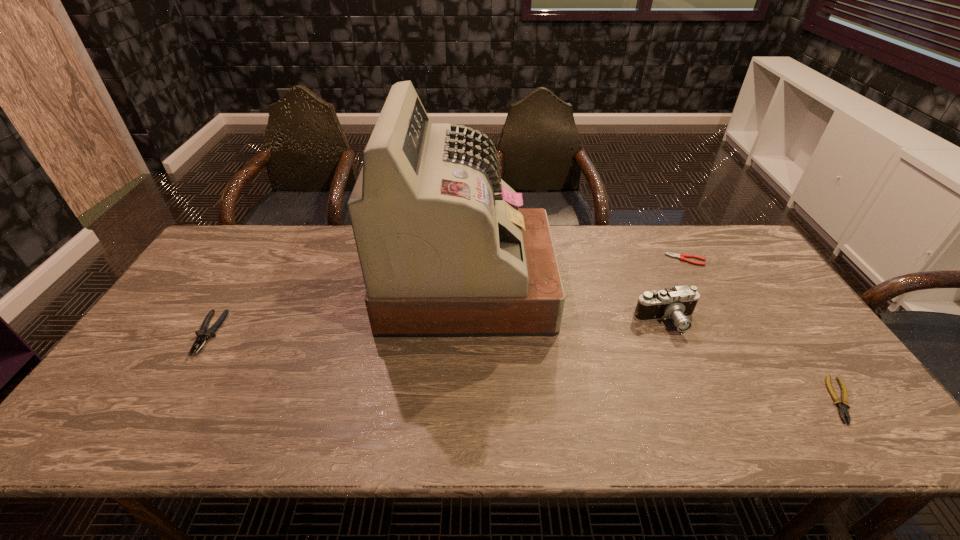
Identify the location of vacant space located 0.110m on the operating side of the cash register. coord(588,284).

This screenshot has width=960, height=540. What are the coordinates of `vacant space located at the lens of the third object from left to right` in the screenshot? It's located at (712, 429).

What are the coordinates of `free location located 0.070m at the gripping part of the third shortest object` in the screenshot? It's located at (180, 380).

Locate an element on the screen. free location located on the back of the second pliers from left to right is located at coordinates (678, 245).

You are a GUI agent. You are given a task and a screenshot of the screen. Output one action in this format:
    pyautogui.click(x=<x>, y=<y>)
    Task: Click on the vacant position located on the left of the rightmost pliers
    
    Given the screenshot: What is the action you would take?
    pyautogui.click(x=686, y=400)

The height and width of the screenshot is (540, 960). In order to click on cash register that is at the far edge in this screenshot , I will do coord(445,251).

I want to click on pliers that is positioned at the far edge, so click(681, 256).

You are a GUI agent. You are given a task and a screenshot of the screen. Output one action in this format:
    pyautogui.click(x=<x>, y=<y>)
    Task: Click on the object at the near edge
    The image size is (960, 540).
    Given the screenshot: What is the action you would take?
    pyautogui.click(x=842, y=404)

Where is `object that is at the left edge`? object that is at the left edge is located at coordinates (204, 334).

The width and height of the screenshot is (960, 540). I want to click on object present at the far right corner, so click(681, 256).